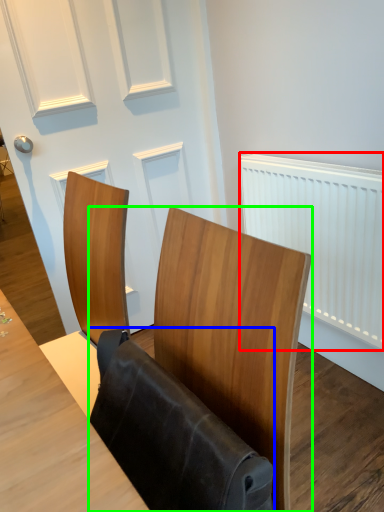
Question: Which is nearer to the radiator (highlighted by a red box)? folding chair (highlighted by a blue box) or furniture (highlighted by a green box).

Choices:
 (A) folding chair
 (B) furniture

Answer: (B)